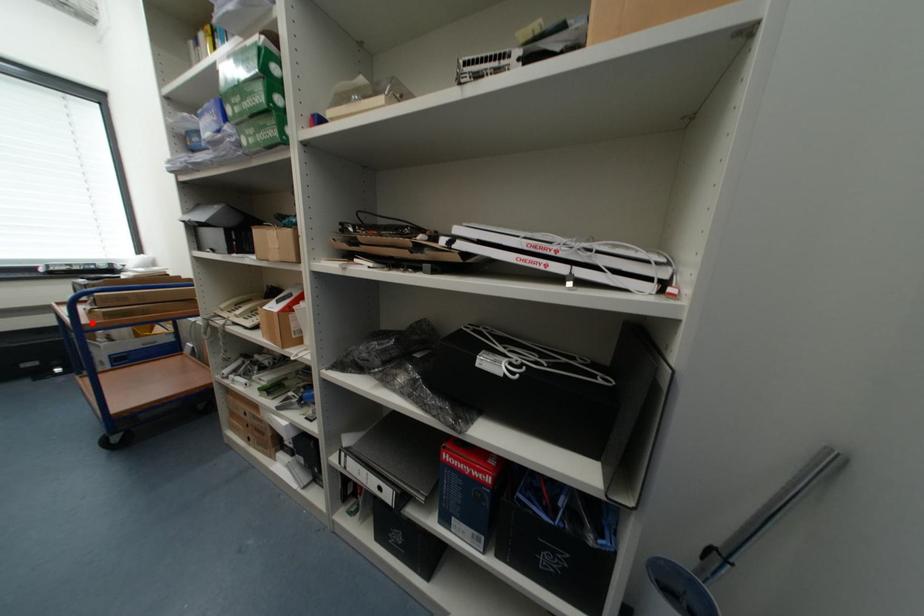
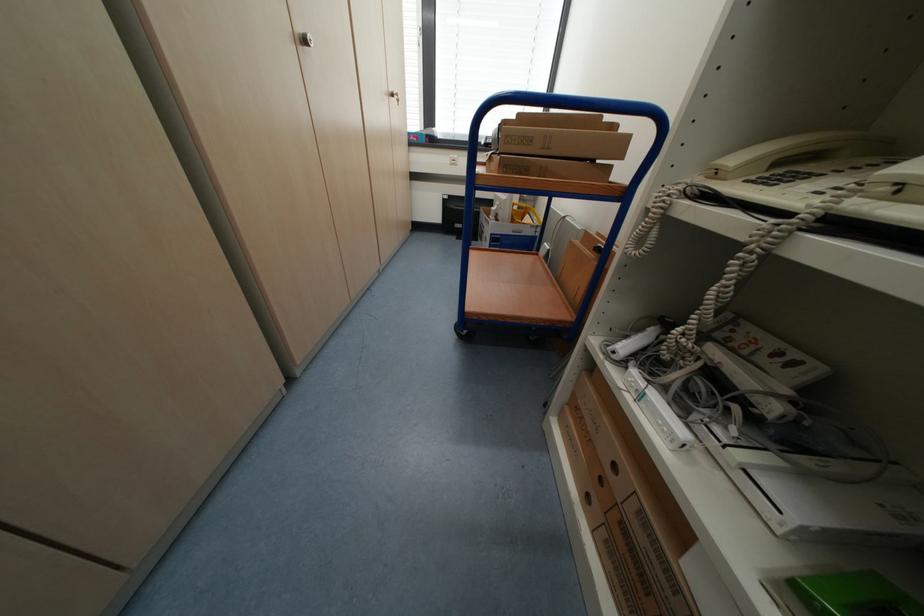
Where in the second image is the point corresponding to the highlighted location from the first image?

(485, 171)